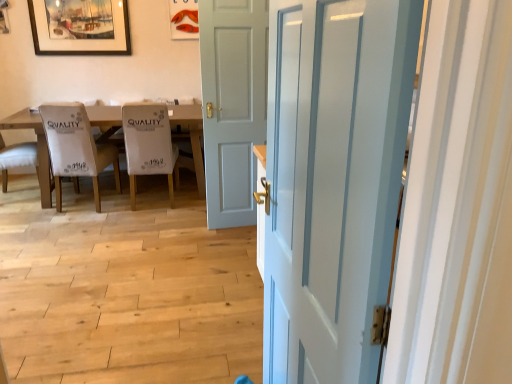
This screenshot has height=384, width=512. In order to click on vacant area situated to the left side of light gray wood door at center, which appears as the 1th door when viewed from the back in this screenshot , I will do `click(196, 223)`.